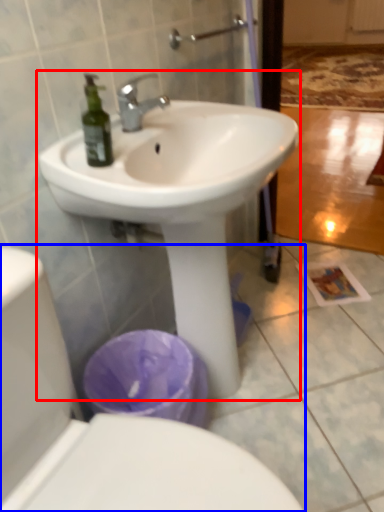
Question: Which of the following is the farthest to the observer, sink (highlighted by a red box) or toilet (highlighted by a blue box)?

Choices:
 (A) sink
 (B) toilet

Answer: (A)